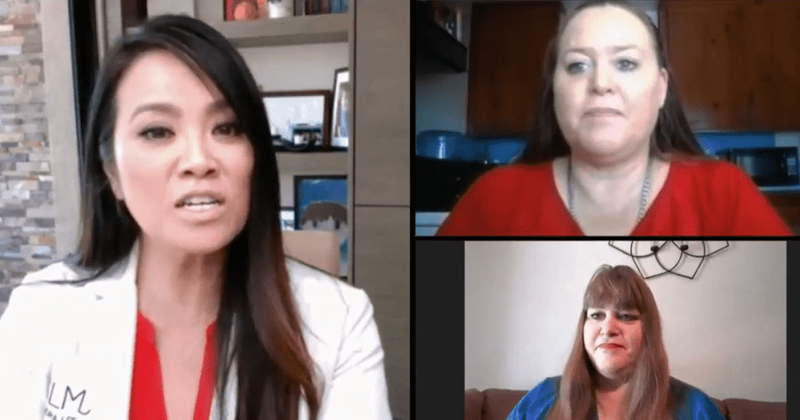
Locate an element on the screen. wall art is located at coordinates (684, 270).